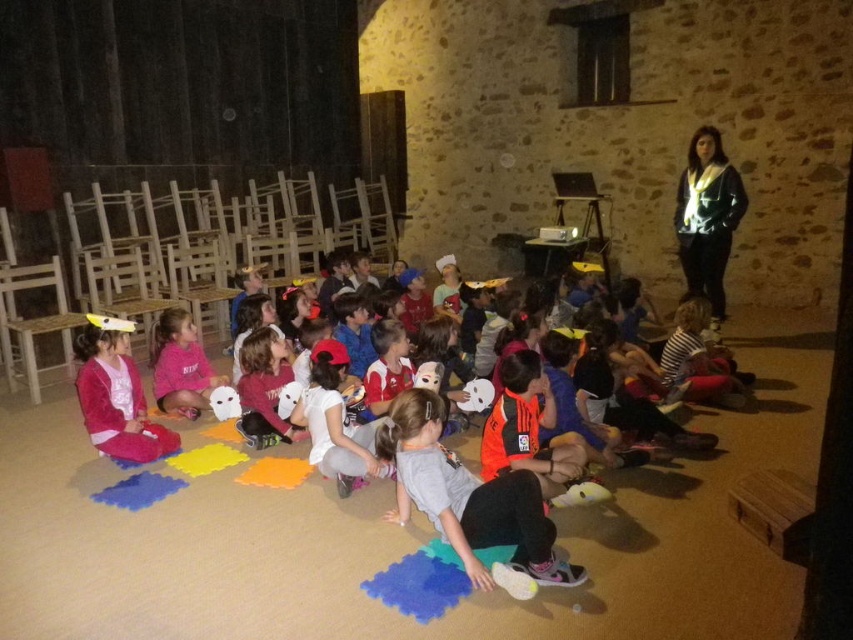
You are a photographer setting up for a group photo in the room described. You notice the orange jersey at center and the pink fabric mask at lower left. To ensure both items are visible in the frame, which item should you prioritize positioning closer to the camera?

The orange jersey at center should be prioritized closer to the camera since it might be wider than the pink fabric mask at lower left, ensuring it fits within the frame.

You are a child sitting on the floor in the rustic room with stone walls. You need to find the pink fabric mask at lower left. Where exactly is it located in the room?

The pink fabric mask at lower left is located at the coordinates point [115,394] in the room.